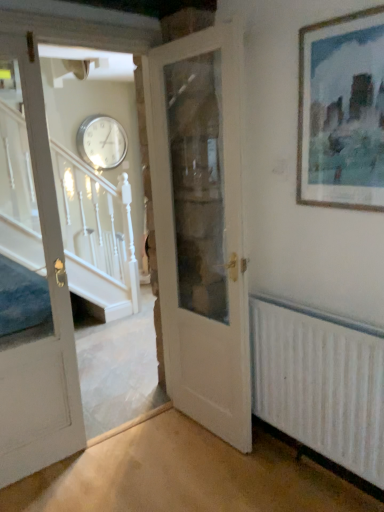
Identify the location of vacant region below white wooden door at center, placed as the 1th door when sorted from right to left (from a real-world perspective). The height and width of the screenshot is (512, 384). (201, 432).